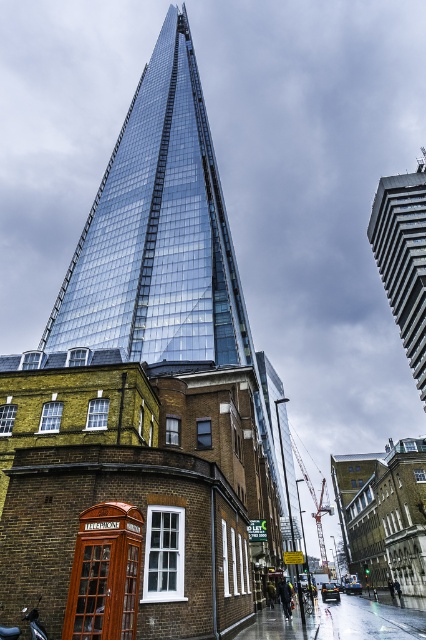
You are a tourist standing in the middle of the square. You want to take a photo of both the wooden telephone box at lower left and the glassy steel building at upper right in the same frame. Which object should you position closer to the camera to ensure both fit in the photo?

You should position the wooden telephone box at lower left closer to the camera since it is shorter than the glassy steel building at upper right, allowing both to be captured in the same frame.

You are standing at the entrance of the traditional red telephone box near the historic brick building. You want to take a photo of the glassy steel tower at center. In which direction should you walk to get a better view of the tower?

Since the glassy steel tower at center is located at point [158,230], you should walk towards the center of the scene to get a better view of the tower.